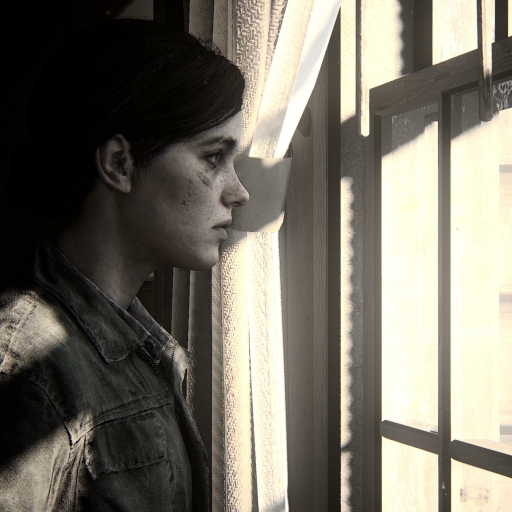
Where is `curtain`? curtain is located at coordinates (254, 37).